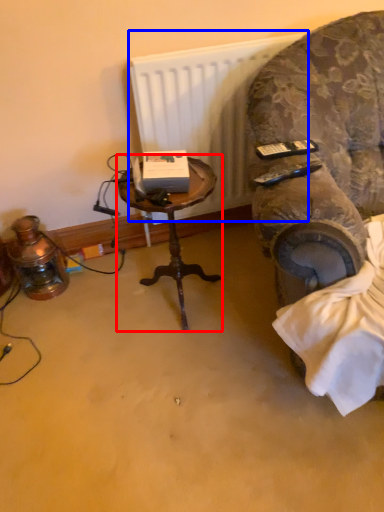
Question: Which object appears farthest to the camera in this image, table (highlighted by a red box) or radiator (highlighted by a blue box)?

Choices:
 (A) table
 (B) radiator

Answer: (B)